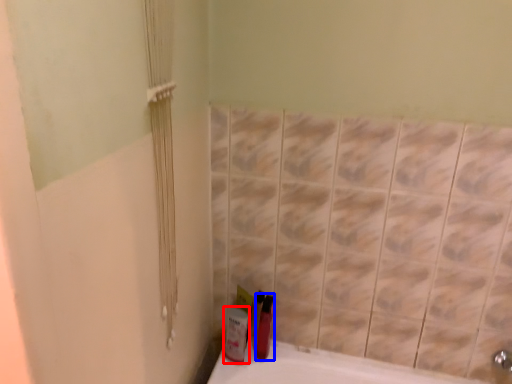
Question: Which object is further to the camera taking this photo, mouthwash (highlighted by a red box) or mouthwash (highlighted by a blue box)?

Choices:
 (A) mouthwash
 (B) mouthwash

Answer: (B)